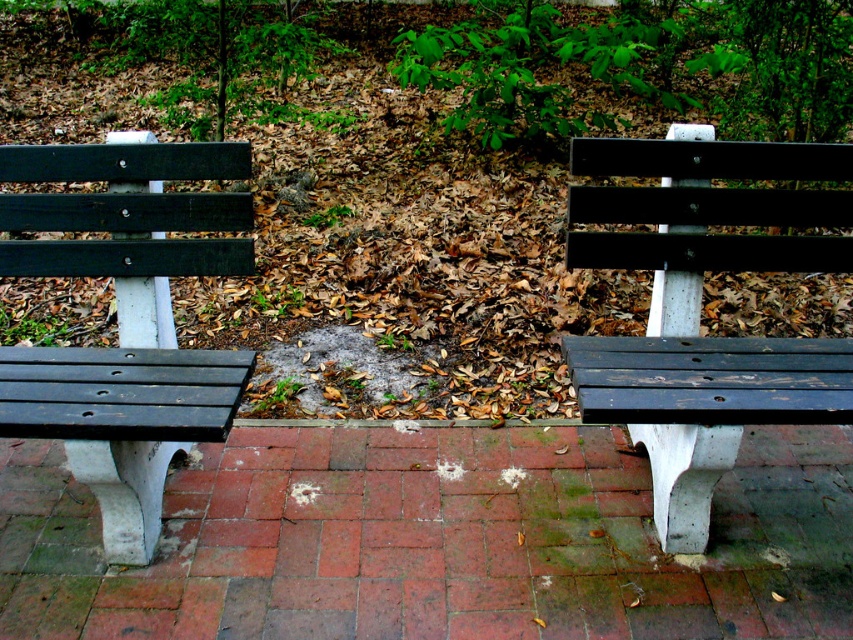
Question: Is matte black bench at right below matte black bench at left?

Choices:
 (A) no
 (B) yes

Answer: (B)

Question: Can you confirm if matte black bench at right is wider than matte black bench at left?

Choices:
 (A) yes
 (B) no

Answer: (A)

Question: Does matte black bench at right have a lesser width compared to matte black bench at left?

Choices:
 (A) yes
 (B) no

Answer: (B)

Question: Which point is farther from the camera taking this photo?

Choices:
 (A) (148, 301)
 (B) (838, 243)

Answer: (A)